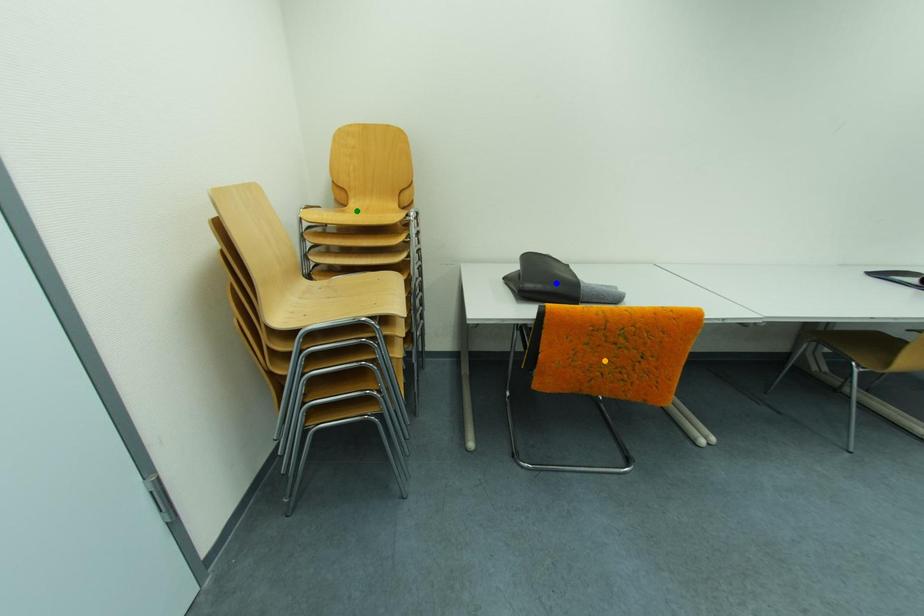
Order these from nearest to farthest:
green point, orange point, blue point

orange point < green point < blue point